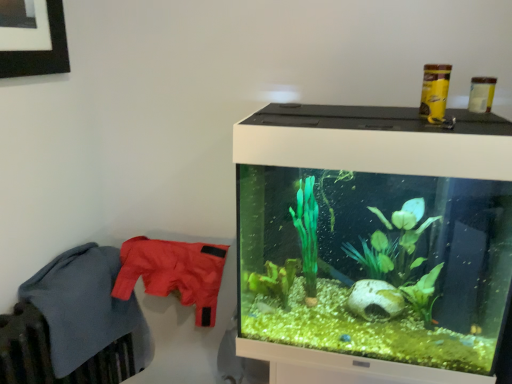
Consider the image. Measure the distance between matte nylon jacket at left, arranged as the second clothing when viewed from the left, and camera.

matte nylon jacket at left, arranged as the second clothing when viewed from the left, and camera are 1.42 meters apart from each other.

Where is `matte nylon jacket at left, arranged as the second clothing when viewed from the left`? This screenshot has width=512, height=384. matte nylon jacket at left, arranged as the second clothing when viewed from the left is located at coordinates (173, 272).

The height and width of the screenshot is (384, 512). Describe the element at coordinates (86, 307) in the screenshot. I see `soft fleece blanket at left, positioned as the 2th clothing in right-to-left order` at that location.

In order to click on transparent glass aquarium at right in this screenshot , I will do `click(372, 244)`.

Identify the location of matte nylon jacket at left, arranged as the second clothing when viewed from the left. The image size is (512, 384). (173, 272).

Which object is positioned more to the left, matte nylon jacket at left, arranged as the second clothing when viewed from the left, or soft fleece blanket at left, the 1th clothing in the left-to-right sequence?

soft fleece blanket at left, the 1th clothing in the left-to-right sequence, is more to the left.

Is matte nylon jacket at left, marked as the first clothing in a right-to-left arrangement, taller or shorter than soft fleece blanket at left, positioned as the 2th clothing in right-to-left order?

matte nylon jacket at left, marked as the first clothing in a right-to-left arrangement, is shorter than soft fleece blanket at left, positioned as the 2th clothing in right-to-left order.

Is point (215, 251) closer to viewer compared to point (79, 303)?

That is False.

From the image's perspective, is matte nylon jacket at left, arranged as the second clothing when viewed from the left, located above or below soft fleece blanket at left, the 1th clothing in the left-to-right sequence?

From the image's perspective, matte nylon jacket at left, arranged as the second clothing when viewed from the left, appears above soft fleece blanket at left, the 1th clothing in the left-to-right sequence.

How distant is soft fleece blanket at left, the 1th clothing in the left-to-right sequence, from matte nylon jacket at left, marked as the first clothing in a right-to-left arrangement?

The distance of soft fleece blanket at left, the 1th clothing in the left-to-right sequence, from matte nylon jacket at left, marked as the first clothing in a right-to-left arrangement, is 6.48 inches.

Visually, is soft fleece blanket at left, positioned as the 2th clothing in right-to-left order, positioned to the left or to the right of matte nylon jacket at left, arranged as the second clothing when viewed from the left?

soft fleece blanket at left, positioned as the 2th clothing in right-to-left order, is positioned on matte nylon jacket at left, arranged as the second clothing when viewed from the left,'s left side.

Image resolution: width=512 pixels, height=384 pixels. In order to click on clothing located on the left of matte nylon jacket at left, marked as the first clothing in a right-to-left arrangement in this screenshot , I will do `click(86, 307)`.

Which object is further away from the camera taking this photo, soft fleece blanket at left, the 1th clothing in the left-to-right sequence, or matte nylon jacket at left, arranged as the second clothing when viewed from the left?

matte nylon jacket at left, arranged as the second clothing when viewed from the left, is further away from the camera.

In terms of width, does transparent glass aquarium at right look wider or thinner when compared to soft fleece blanket at left, the 1th clothing in the left-to-right sequence?

In the image, transparent glass aquarium at right appears to be wider than soft fleece blanket at left, the 1th clothing in the left-to-right sequence.

Between transparent glass aquarium at right and soft fleece blanket at left, the 1th clothing in the left-to-right sequence, which one has larger size?

Bigger between the two is transparent glass aquarium at right.

Does transparent glass aquarium at right come in front of soft fleece blanket at left, the 1th clothing in the left-to-right sequence?

Yes, it is in front of soft fleece blanket at left, the 1th clothing in the left-to-right sequence.

From a real-world perspective, which is physically above, transparent glass aquarium at right or soft fleece blanket at left, the 1th clothing in the left-to-right sequence?

In real-world perspective, transparent glass aquarium at right is above.

Which of these two, transparent glass aquarium at right or matte nylon jacket at left, marked as the first clothing in a right-to-left arrangement, stands taller?

With more height is transparent glass aquarium at right.

Is transparent glass aquarium at right spatially inside matte nylon jacket at left, arranged as the second clothing when viewed from the left, or outside of it?

transparent glass aquarium at right cannot be found inside matte nylon jacket at left, arranged as the second clothing when viewed from the left.

Is transparent glass aquarium at right next to matte nylon jacket at left, arranged as the second clothing when viewed from the left, and touching it?

transparent glass aquarium at right is not next to matte nylon jacket at left, arranged as the second clothing when viewed from the left, and they're not touching.

Which of these two, transparent glass aquarium at right or matte nylon jacket at left, marked as the first clothing in a right-to-left arrangement, is smaller?

matte nylon jacket at left, marked as the first clothing in a right-to-left arrangement, is smaller.

From a real-world perspective, is soft fleece blanket at left, the 1th clothing in the left-to-right sequence, above or below transparent glass aquarium at right?

From a real-world perspective, soft fleece blanket at left, the 1th clothing in the left-to-right sequence, is physically below transparent glass aquarium at right.

How different are the orientations of soft fleece blanket at left, the 1th clothing in the left-to-right sequence, and transparent glass aquarium at right in degrees?

The facing directions of soft fleece blanket at left, the 1th clothing in the left-to-right sequence, and transparent glass aquarium at right are 89.1 degrees apart.

Which is closer to the camera, [148,329] or [409,345]?

The point [409,345] is more forward.

Is soft fleece blanket at left, the 1th clothing in the left-to-right sequence, in front of or behind transparent glass aquarium at right in the image?

soft fleece blanket at left, the 1th clothing in the left-to-right sequence, is positioned farther from the viewer than transparent glass aquarium at right.

Do you think matte nylon jacket at left, arranged as the second clothing when viewed from the left, is within transparent glass aquarium at right, or outside of it?

The correct answer is: outside.

From a real-world perspective, which is physically below, matte nylon jacket at left, arranged as the second clothing when viewed from the left, or transparent glass aquarium at right?

From a 3D spatial view, matte nylon jacket at left, arranged as the second clothing when viewed from the left, is below.

Considering the relative positions of matte nylon jacket at left, arranged as the second clothing when viewed from the left, and transparent glass aquarium at right in the image provided, is matte nylon jacket at left, arranged as the second clothing when viewed from the left, to the left of transparent glass aquarium at right from the viewer's perspective?

Yes.

Is matte nylon jacket at left, marked as the first clothing in a right-to-left arrangement, facing towards transparent glass aquarium at right?

No, matte nylon jacket at left, marked as the first clothing in a right-to-left arrangement, is not aimed at transparent glass aquarium at right.

At what (x,y) coordinates should I click in order to perform the action: click on clothing on the left of matte nylon jacket at left, arranged as the second clothing when viewed from the left. Please return your answer as a coordinate pair (x, y). The width and height of the screenshot is (512, 384). Looking at the image, I should click on (86, 307).

Image resolution: width=512 pixels, height=384 pixels. What are the coordinates of `clothing on the right of the soft fleece blanket at left, the 1th clothing in the left-to-right sequence` in the screenshot? It's located at (173, 272).

Estimate the real-world distances between objects in this image. Which object is closer to soft fleece blanket at left, positioned as the 2th clothing in right-to-left order, matte nylon jacket at left, arranged as the second clothing when viewed from the left, or transparent glass aquarium at right?

Among the two, matte nylon jacket at left, arranged as the second clothing when viewed from the left, is located nearer to soft fleece blanket at left, positioned as the 2th clothing in right-to-left order.

Based on their spatial positions, is soft fleece blanket at left, the 1th clothing in the left-to-right sequence, or matte nylon jacket at left, arranged as the second clothing when viewed from the left, closer to transparent glass aquarium at right?

matte nylon jacket at left, arranged as the second clothing when viewed from the left, lies closer to transparent glass aquarium at right than the other object.

From the image, which object appears to be farther from transparent glass aquarium at right, matte nylon jacket at left, marked as the first clothing in a right-to-left arrangement, or soft fleece blanket at left, positioned as the 2th clothing in right-to-left order?

Among the two, soft fleece blanket at left, positioned as the 2th clothing in right-to-left order, is located further to transparent glass aquarium at right.

Which object lies nearer to the anchor point matte nylon jacket at left, arranged as the second clothing when viewed from the left, soft fleece blanket at left, the 1th clothing in the left-to-right sequence, or transparent glass aquarium at right?

soft fleece blanket at left, the 1th clothing in the left-to-right sequence, is closer to matte nylon jacket at left, arranged as the second clothing when viewed from the left.

Based on the photo, which object lies nearer to the anchor point soft fleece blanket at left, the 1th clothing in the left-to-right sequence, transparent glass aquarium at right or matte nylon jacket at left, arranged as the second clothing when viewed from the left?

matte nylon jacket at left, arranged as the second clothing when viewed from the left, lies closer to soft fleece blanket at left, the 1th clothing in the left-to-right sequence, than the other object.

Based on their spatial positions, is transparent glass aquarium at right or soft fleece blanket at left, the 1th clothing in the left-to-right sequence, further from matte nylon jacket at left, arranged as the second clothing when viewed from the left?

Among the two, transparent glass aquarium at right is located further to matte nylon jacket at left, arranged as the second clothing when viewed from the left.

Locate an element on the screen. This screenshot has width=512, height=384. clothing between soft fleece blanket at left, the 1th clothing in the left-to-right sequence, and transparent glass aquarium at right, in the horizontal direction is located at coordinates (173, 272).